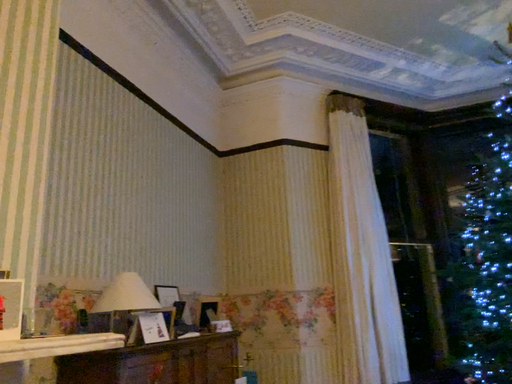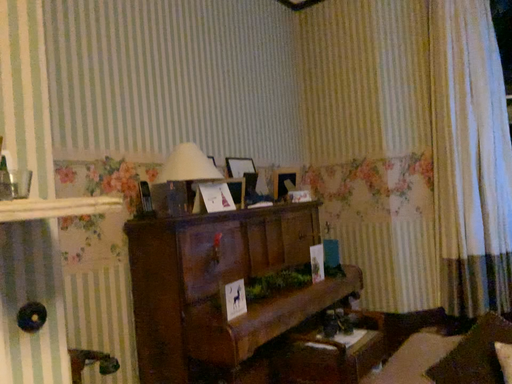
Question: Which way did the camera rotate in the video?

Choices:
 (A) rotated upward
 (B) rotated downward

Answer: (B)